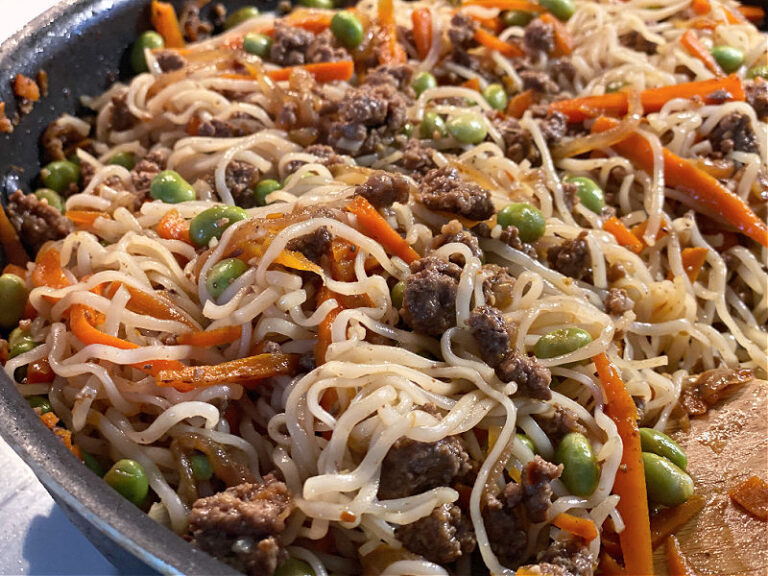
Find the location of `bowl`. bowl is located at coordinates pos(107,507).